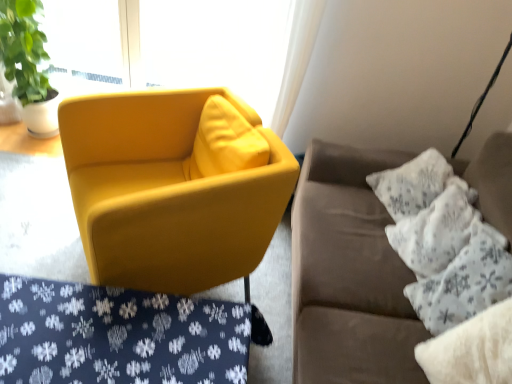
What is the approximate height of matte glass window at upper left?

82.83 centimeters.

What do you see at coordinates (349, 275) in the screenshot?
I see `suede couch at right` at bounding box center [349, 275].

What do you see at coordinates (436, 230) in the screenshot? I see `white textured pillow at right, positioned as the third pillow in front-to-back order` at bounding box center [436, 230].

What is the approximate height of matte yellow armchair at center?

The height of matte yellow armchair at center is 29.38 inches.

Locate an element on the screen. This screenshot has height=384, width=512. velvet yellow armchair at center is located at coordinates (118, 335).

Where is `chair above the white fluffy pillow at right, the first pillow when ordered from front to back (from the image's perspective)`? chair above the white fluffy pillow at right, the first pillow when ordered from front to back (from the image's perspective) is located at coordinates (168, 191).

Choose the correct answer: Is matte yellow armchair at center inside white fluffy pillow at right, which appears as the third pillow when viewed from the back, or outside it?

matte yellow armchair at center cannot be found inside white fluffy pillow at right, which appears as the third pillow when viewed from the back.

Is matte yellow armchair at center shorter than white fluffy pillow at right, which appears as the third pillow when viewed from the back?

Incorrect, the height of matte yellow armchair at center does not fall short of that of white fluffy pillow at right, which appears as the third pillow when viewed from the back.

Is matte yellow armchair at center wider or thinner than white fluffy pillow at right, which appears as the third pillow when viewed from the back?

Considering their sizes, matte yellow armchair at center looks broader than white fluffy pillow at right, which appears as the third pillow when viewed from the back.

Is velvet yellow armchair at center closer to the viewer compared to white textured pillow at right, positioned as the third pillow in front-to-back order?

Yes, velvet yellow armchair at center is closer to the camera.

How far apart are velvet yellow armchair at center and white textured pillow at right, which ranks as the first pillow in back-to-front order?

They are 90.80 centimeters apart.

From the image's perspective, is velvet yellow armchair at center under white textured pillow at right, positioned as the third pillow in front-to-back order?

Correct, velvet yellow armchair at center appears lower than white textured pillow at right, positioned as the third pillow in front-to-back order, in the image.

From a real-world perspective, between velvet yellow armchair at center and white textured pillow at right, which ranks as the first pillow in back-to-front order, who is vertically higher?

white textured pillow at right, which ranks as the first pillow in back-to-front order, is physically above.

Is white fluffy pillow at right, the first pillow when ordered from front to back, outside of matte yellow armchair at center?

white fluffy pillow at right, the first pillow when ordered from front to back, is positioned outside matte yellow armchair at center.

Based on the photo, can you confirm if white fluffy pillow at right, the first pillow when ordered from front to back, is positioned to the left of matte yellow armchair at center?

No.

In the scene shown: Is white fluffy pillow at right, the first pillow when ordered from front to back, in front of or behind matte yellow armchair at center in the image?

white fluffy pillow at right, the first pillow when ordered from front to back, is in front of matte yellow armchair at center.

Based on their sizes in the image, would you say white fluffy pillow at right, the first pillow when ordered from front to back, is bigger or smaller than matte yellow armchair at center?

Clearly, white fluffy pillow at right, the first pillow when ordered from front to back, is smaller in size than matte yellow armchair at center.

Which object is wider, suede couch at right or velvet yellow armchair at center?

Wider between the two is velvet yellow armchair at center.

Is the position of suede couch at right more distant than that of velvet yellow armchair at center?

No, it is in front of velvet yellow armchair at center.

Considering the positions of point (370, 344) and point (25, 374), is point (370, 344) closer or farther from the camera than point (25, 374)?

Point (370, 344) appears to be farther away from the viewer than point (25, 374).

From a real-world perspective, is suede couch at right positioned over velvet yellow armchair at center based on gravity?

Yes, from a real-world perspective, suede couch at right is over velvet yellow armchair at center

Considering the relative sizes of white fluffy pillow at right, the first pillow when ordered from front to back, and velvet yellow armchair at center in the image provided, is white fluffy pillow at right, the first pillow when ordered from front to back, taller than velvet yellow armchair at center?

No.

Looking at this image, between white fluffy pillow at right, the first pillow when ordered from front to back, and velvet yellow armchair at center, which one is positioned in front?

white fluffy pillow at right, the first pillow when ordered from front to back.

Could you tell me if white fluffy pillow at right, which appears as the third pillow when viewed from the back, is facing velvet yellow armchair at center?

Yes, white fluffy pillow at right, which appears as the third pillow when viewed from the back, faces towards velvet yellow armchair at center.

From a real-world perspective, which is physically below, matte yellow armchair at center or white textured pillow at right, placed as the 2th pillow when sorted from back to front?

From a 3D spatial view, matte yellow armchair at center is below.

Consider the image. Is matte yellow armchair at center surrounding white textured pillow at right, placed as the 2th pillow when sorted from back to front?

No, white textured pillow at right, placed as the 2th pillow when sorted from back to front, is located outside of matte yellow armchair at center.

Which point is more distant from viewer, (213, 224) or (483, 296)?

The point (213, 224) is farther.

Locate an element on the screen. the 3rd pillow to the right of the matte yellow armchair at center, starting your count from the anchor is located at coordinates (465, 282).

Find the location of `the 3rd pillow in front of the matte glass window at upper left, starting your count from the anchor`. the 3rd pillow in front of the matte glass window at upper left, starting your count from the anchor is located at coordinates (471, 349).

Is white fluffy pillow at right, the first pillow when ordered from front to back, directly adjacent to matte glass window at upper left?

No, white fluffy pillow at right, the first pillow when ordered from front to back, is not in contact with matte glass window at upper left.

Which point is more distant from viewer, (488,322) or (194,73)?

The point (194,73) is more distant.

Is white fluffy pillow at right, which appears as the third pillow when viewed from the back, closer to camera compared to matte glass window at upper left?

Yes, it is.

Where is `the 2nd pillow positioned above the matte yellow armchair at center (from a real-world perspective)`? the 2nd pillow positioned above the matte yellow armchair at center (from a real-world perspective) is located at coordinates (471, 349).

Locate an element on the screen. This screenshot has height=384, width=512. the 3rd pillow above the velvet yellow armchair at center (from the image's perspective) is located at coordinates (436, 230).

In the scene shown: Based on their spatial positions, is suede couch at right or matte glass window at upper left further from matte yellow armchair at center?

matte glass window at upper left.

Based on their spatial positions, is suede couch at right or matte glass window at upper left closer to velvet yellow armchair at center?

suede couch at right lies closer to velvet yellow armchair at center than the other object.

Looking at the image, which one is located closer to velvet yellow armchair at center, matte yellow armchair at center or white textured pillow at right, the second pillow in the front-to-back sequence?

matte yellow armchair at center is closer to velvet yellow armchair at center.

Estimate the real-world distances between objects in this image. Which object is further from matte glass window at upper left, velvet yellow armchair at center or matte yellow armchair at center?

Among the two, velvet yellow armchair at center is located further to matte glass window at upper left.

Looking at this image, from the image, which object appears to be nearer to suede couch at right, white fluffy pillow at right, the first pillow when ordered from front to back, or matte glass window at upper left?

→ white fluffy pillow at right, the first pillow when ordered from front to back, is closer to suede couch at right.

When comparing their distances from white textured pillow at right, which ranks as the first pillow in back-to-front order, does velvet yellow armchair at center or white textured pillow at right, placed as the 2th pillow when sorted from back to front, seem closer?

The object closer to white textured pillow at right, which ranks as the first pillow in back-to-front order, is white textured pillow at right, placed as the 2th pillow when sorted from back to front.

Looking at the image, which one is located closer to velvet yellow armchair at center, suede couch at right or white textured pillow at right, placed as the 2th pillow when sorted from back to front?

Among the two, suede couch at right is located nearer to velvet yellow armchair at center.

Looking at the image, which one is located closer to velvet yellow armchair at center, white textured pillow at right, placed as the 2th pillow when sorted from back to front, or white fluffy pillow at right, which appears as the third pillow when viewed from the back?

The object closer to velvet yellow armchair at center is white fluffy pillow at right, which appears as the third pillow when viewed from the back.

This screenshot has height=384, width=512. I want to click on chair between velvet yellow armchair at center and suede couch at right from left to right, so click(168, 191).

The height and width of the screenshot is (384, 512). I want to click on studio couch between matte yellow armchair at center and white textured pillow at right, which ranks as the first pillow in back-to-front order, from left to right, so pos(349,275).

This screenshot has height=384, width=512. Identify the location of studio couch located between matte glass window at upper left and white textured pillow at right, which ranks as the first pillow in back-to-front order, in the left-right direction. (349, 275).

This screenshot has height=384, width=512. What are the coordinates of `pillow situated between velvet yellow armchair at center and white textured pillow at right, positioned as the third pillow in front-to-back order, from left to right` in the screenshot? It's located at (471, 349).